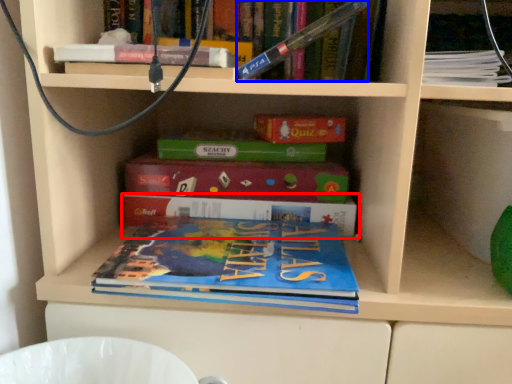
Question: Which object appears closest to the camera in this image, book (highlighted by a red box) or book (highlighted by a blue box)?

Choices:
 (A) book
 (B) book

Answer: (B)